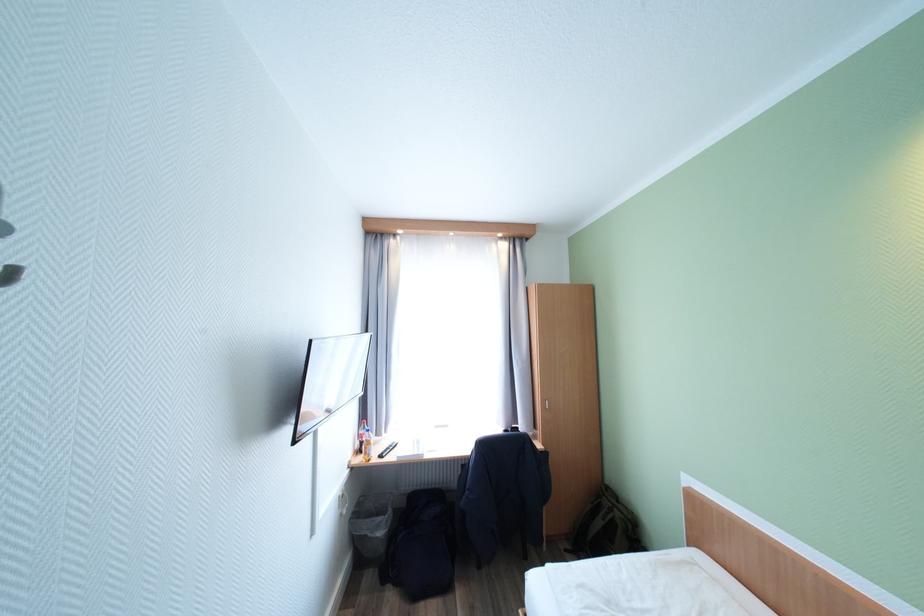
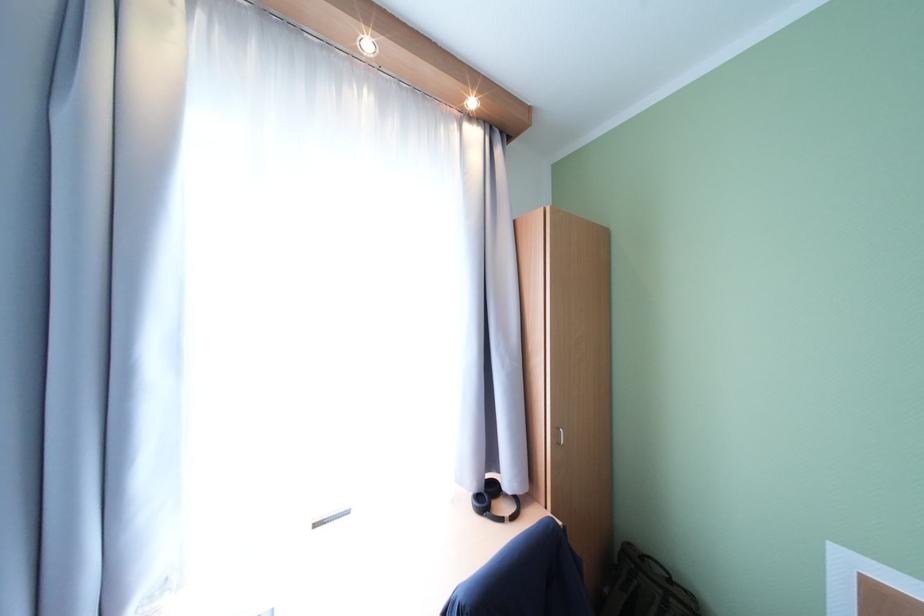
Question: The images are taken continuously from a first-person perspective. In which direction are you moving?

Choices:
 (A) Left
 (B) Right
 (C) Forward
 (D) Backward

Answer: (C)